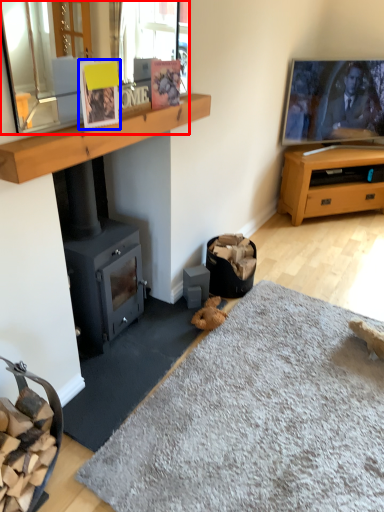
Question: Which of the following is the closest to the observer, mirror (highlighted by a red box) or picture frame (highlighted by a blue box)?

Choices:
 (A) mirror
 (B) picture frame

Answer: (A)